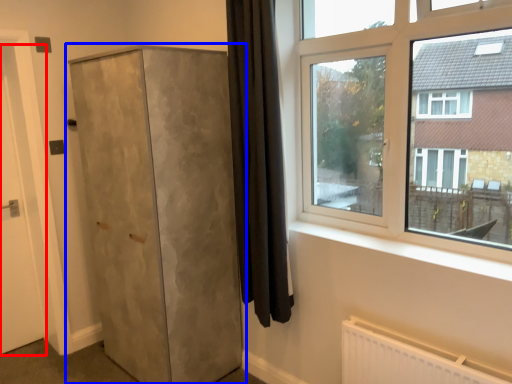
Question: Among these objects, which one is nearest to the camera, door (highlighted by a red box) or cupboard (highlighted by a blue box)?

Choices:
 (A) door
 (B) cupboard

Answer: (B)